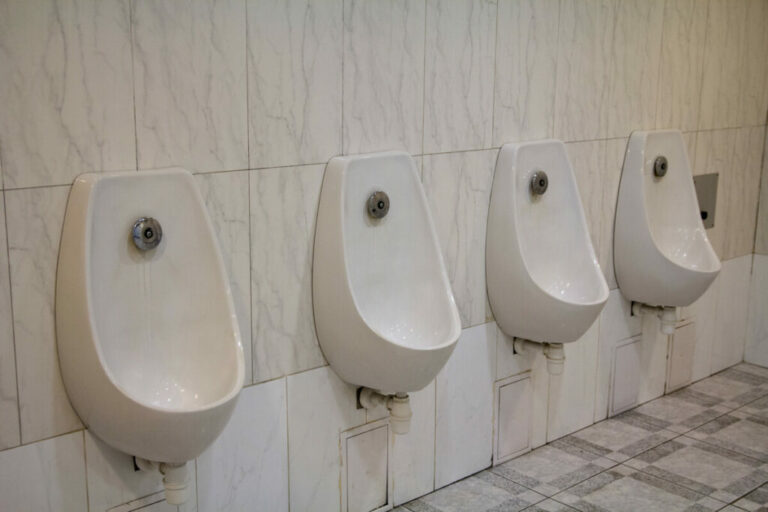
Find the location of `urinals`. urinals is located at coordinates [137, 330], [369, 330], [551, 251], [693, 241].